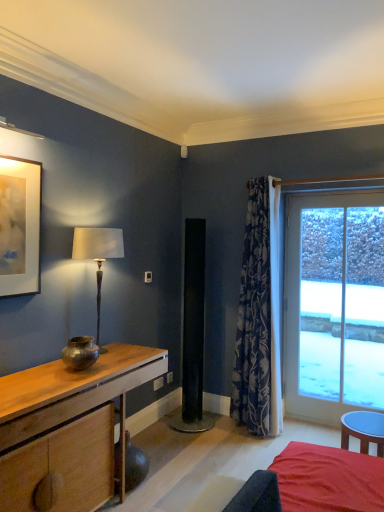
Where is `matte bronze lamp at left`? matte bronze lamp at left is located at coordinates pyautogui.click(x=97, y=255).

The width and height of the screenshot is (384, 512). Find the location of `transparent glass door at right`. transparent glass door at right is located at coordinates (334, 305).

The image size is (384, 512). What do you see at coordinates (334, 305) in the screenshot?
I see `transparent glass door at right` at bounding box center [334, 305].

Measure the distance between blue floral fabric curtain at right and camera.

blue floral fabric curtain at right and camera are 3.53 meters apart from each other.

In order to face blue floral fabric curtain at right, should I rotate leftwards or rightwards?

Turn right approximately 8.322 degrees to face it.

The width and height of the screenshot is (384, 512). Describe the element at coordinates (80, 352) in the screenshot. I see `bronze metallic vase at left` at that location.

Locate an element on the screen. Image resolution: width=384 pixels, height=512 pixels. matte gold picture frame at upper left is located at coordinates (19, 226).

The image size is (384, 512). I want to click on matte bronze lamp at left, so click(x=97, y=255).

Does transparent glass door at right turn towards blue floral fabric curtain at right?

No, transparent glass door at right is not aimed at blue floral fabric curtain at right.

Is transparent glass door at right taller than blue floral fabric curtain at right?

No.

Which of these two, transparent glass door at right or blue floral fabric curtain at right, is wider?

blue floral fabric curtain at right is wider.

From a real-world perspective, which object stands above the other?

blue floral fabric curtain at right, from a real-world perspective.

Considering the points (63, 364) and (238, 399), which point is in front, point (63, 364) or point (238, 399)?

Positioned in front is point (63, 364).

Based on the photo, is wooden desk at left far away from blue floral fabric curtain at right?

wooden desk at left is positioned a significant distance from blue floral fabric curtain at right.

Is wooden desk at left bigger than blue floral fabric curtain at right?

Yes, wooden desk at left is bigger than blue floral fabric curtain at right.

From the image's perspective, does wooden desk at left appear higher than bronze metallic vase at left?

No.

Are wooden desk at left and bronze metallic vase at left beside each other?

wooden desk at left and bronze metallic vase at left are not in contact.

Considering the sizes of wooden desk at left and bronze metallic vase at left in the image, is wooden desk at left bigger or smaller than bronze metallic vase at left?

wooden desk at left is bigger than bronze metallic vase at left.

How many degrees apart are the facing directions of wooden desk at left and bronze metallic vase at left?

There is a 2.6-degree angle between the facing directions of wooden desk at left and bronze metallic vase at left.

From the picture: Looking at the image, does wooden desk at left seem bigger or smaller compared to matte bronze lamp at left?

Clearly, wooden desk at left is larger in size than matte bronze lamp at left.

Would you consider wooden desk at left to be distant from matte bronze lamp at left?

wooden desk at left is near matte bronze lamp at left, not far away.

From a real-world perspective, between wooden desk at left and matte bronze lamp at left, who is vertically higher?

From a 3D spatial view, matte bronze lamp at left is above.

Consider the image. Would you say wooden desk at left is to the left or to the right of matte bronze lamp at left in the picture?

From the image, it's evident that wooden desk at left is to the left of matte bronze lamp at left.

Considering the relative sizes of matte gold picture frame at upper left and transparent glass door at right in the image provided, is matte gold picture frame at upper left taller than transparent glass door at right?

No, matte gold picture frame at upper left is not taller than transparent glass door at right.

Is transparent glass door at right at the back of matte gold picture frame at upper left?

→ No.

Are matte gold picture frame at upper left and transparent glass door at right far apart?

Absolutely, matte gold picture frame at upper left is distant from transparent glass door at right.

Is transparent glass door at right located within matte gold picture frame at upper left?

No.

Is blue floral fabric curtain at right at the back of bronze metallic vase at left?

bronze metallic vase at left is not turned away from blue floral fabric curtain at right.

In order to click on curtain to the right of bronze metallic vase at left in this screenshot , I will do `click(259, 317)`.

Is bronze metallic vase at left spatially inside blue floral fabric curtain at right, or outside of it?

bronze metallic vase at left is not inside blue floral fabric curtain at right, it's outside.

Is bronze metallic vase at left far from blue floral fabric curtain at right?

bronze metallic vase at left is far away from blue floral fabric curtain at right.

Based on the photo, in the image, is bronze metallic vase at left positioned in front of or behind wooden desk at left?

Clearly, bronze metallic vase at left is behind wooden desk at left.

Does bronze metallic vase at left have a greater height compared to wooden desk at left?

No.

Does point (72, 337) come farther from viewer compared to point (96, 485)?

Yes.

The image size is (384, 512). Identify the location of desk that appears below the bronze metallic vase at left (from a real-world perspective). (68, 430).

The image size is (384, 512). Identify the location of window behind the blue floral fabric curtain at right. (334, 305).

This screenshot has height=512, width=384. Find the location of `desk below the blue floral fabric curtain at right (from a real-world perspective)`. desk below the blue floral fabric curtain at right (from a real-world perspective) is located at coordinates (68, 430).

Based on their spatial positions, is wooden desk at left or bronze metallic vase at left closer to transparent glass door at right?

wooden desk at left lies closer to transparent glass door at right than the other object.

Estimate the real-world distances between objects in this image. Which object is further from transparent glass door at right, matte bronze lamp at left or wooden desk at left?

wooden desk at left.

From the image, which object appears to be farther from bronze metallic vase at left, matte gold picture frame at upper left or transparent glass door at right?

The object further to bronze metallic vase at left is transparent glass door at right.

Based on their spatial positions, is transparent glass door at right or blue floral fabric curtain at right further from matte bronze lamp at left?

The object further to matte bronze lamp at left is transparent glass door at right.

From the image, which object appears to be farther from matte bronze lamp at left, transparent glass door at right or bronze metallic vase at left?

transparent glass door at right.

From the image, which object appears to be farther from transparent glass door at right, velvet red bed at lower right or matte gold picture frame at upper left?

matte gold picture frame at upper left lies further to transparent glass door at right than the other object.

Looking at the image, which one is located further to bronze metallic vase at left, velvet red bed at lower right or blue floral fabric curtain at right?

The object further to bronze metallic vase at left is blue floral fabric curtain at right.

Considering their positions, is bronze metallic vase at left positioned closer to transparent glass door at right than velvet red bed at lower right?

velvet red bed at lower right is positioned closer to the anchor transparent glass door at right.

At what (x,y) coordinates should I click in order to perform the action: click on vase between velvet red bed at lower right and blue floral fabric curtain at right in the front-back direction. Please return your answer as a coordinate pair (x, y). The height and width of the screenshot is (512, 384). Looking at the image, I should click on (80, 352).

Find the location of a particular element. lamp positioned between velvet red bed at lower right and blue floral fabric curtain at right from near to far is located at coordinates (97, 255).

The width and height of the screenshot is (384, 512). What are the coordinates of `desk between matte gold picture frame at upper left and blue floral fabric curtain at right` in the screenshot? It's located at (68, 430).

The width and height of the screenshot is (384, 512). Find the location of `curtain between velvet red bed at lower right and transparent glass door at right from front to back`. curtain between velvet red bed at lower right and transparent glass door at right from front to back is located at coordinates (259, 317).